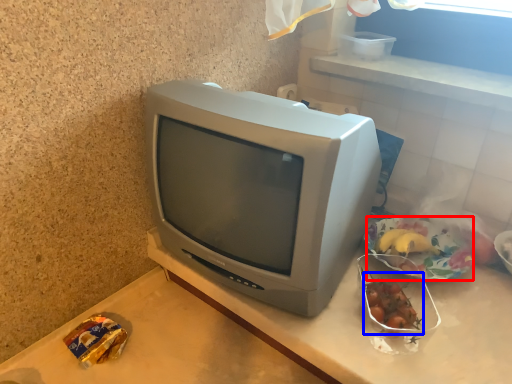
Question: Which of the following is the farthest to the observer, food (highlighted by a red box) or food (highlighted by a blue box)?

Choices:
 (A) food
 (B) food

Answer: (A)